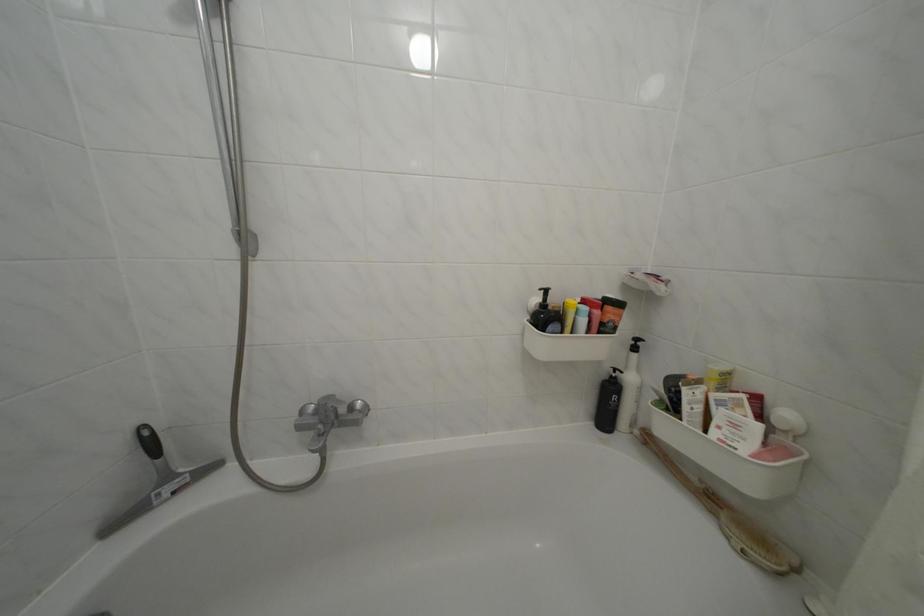
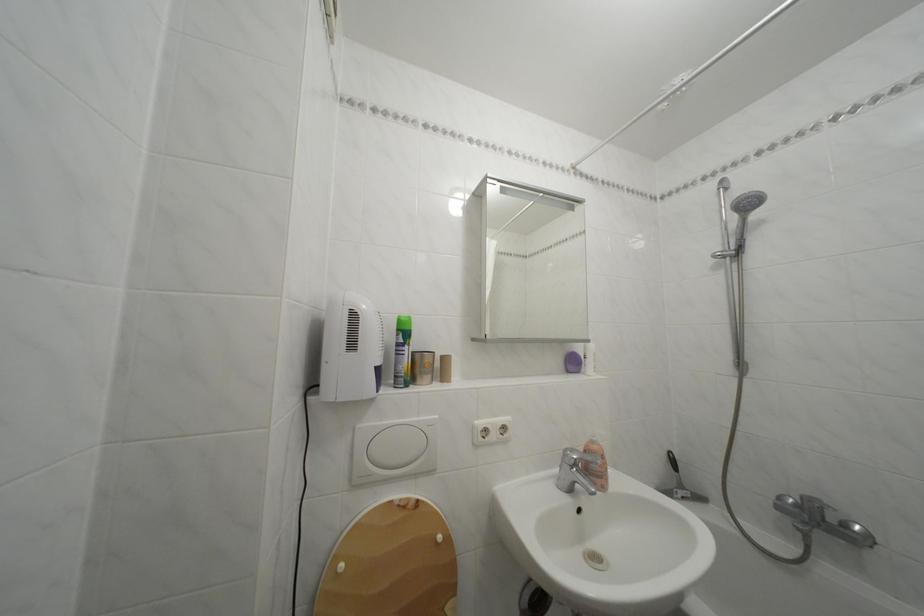
Locate, in the second image, the point that corresponds to [159,448] in the first image.

(682, 468)